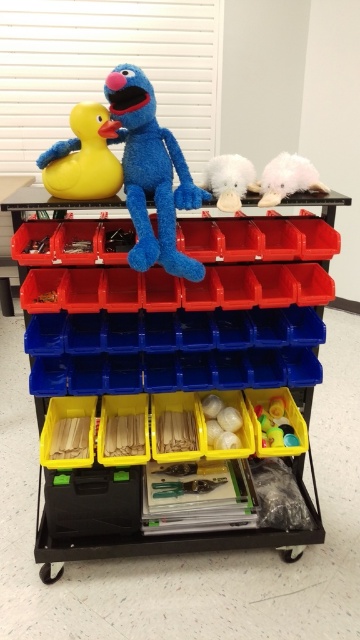
You are organizing a childrens playroom and need to place a new toy that requires a shelf space taller than 12 inches. Looking at the blue plush toy at center and the white fluffy toy at upper right, which one requires more vertical space?

The blue plush toy at center is much taller than the white fluffy toy at upper right, so it requires more vertical space and would need a shelf taller than 12 inches.

You are organizing a child safety inspection and need to ensure that the blue plush toy at center and the fluffy white cloud at upper right are within reach of a child sitting on the floor. Based on their positions, which one is closer to the child?

The blue plush toy at center is closer to the viewer than the fluffy white cloud at upper right, so the blue plush toy at center is within closer reach of the child sitting on the floor.

You are organizing the storage cart and need to place a new item between the blue plush toy at center and the white fluffy toy at upper right. Based on their current positions, where should you place the new item to ensure it is between them?

The blue plush toy at center is positioned on the left side of white fluffy toy at upper right, so placing the new item between them would require placing it to the right of the blue plush toy at center and to the left of the white fluffy toy at upper right.